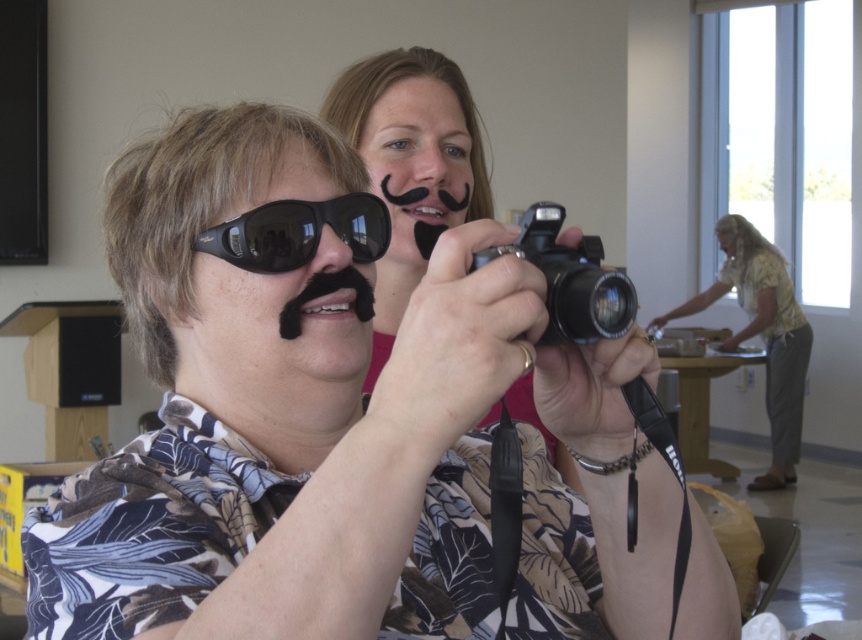
Question: Based on their relative distances, which object is farther from the black matte camera at center?

Choices:
 (A) black matte mustache at center
 (B) floral shirt at right
 (C) black plastic camera at center

Answer: (B)

Question: Which point is closer to the camera?

Choices:
 (A) (366, 129)
 (B) (731, 248)
 (C) (409, 173)

Answer: (C)

Question: Among these objects, which one is nearest to the camera?

Choices:
 (A) black matte camera at center
 (B) black matte mustache at center
 (C) black matte sunglasses at center

Answer: (C)

Question: Is black matte mustache at center above floral shirt at right?

Choices:
 (A) no
 (B) yes

Answer: (B)

Question: Does black matte sunglasses at center have a greater width compared to black reflective sunglasses at center?

Choices:
 (A) no
 (B) yes

Answer: (B)

Question: Can you confirm if floral shirt at right is wider than black plastic camera at center?

Choices:
 (A) yes
 (B) no

Answer: (A)